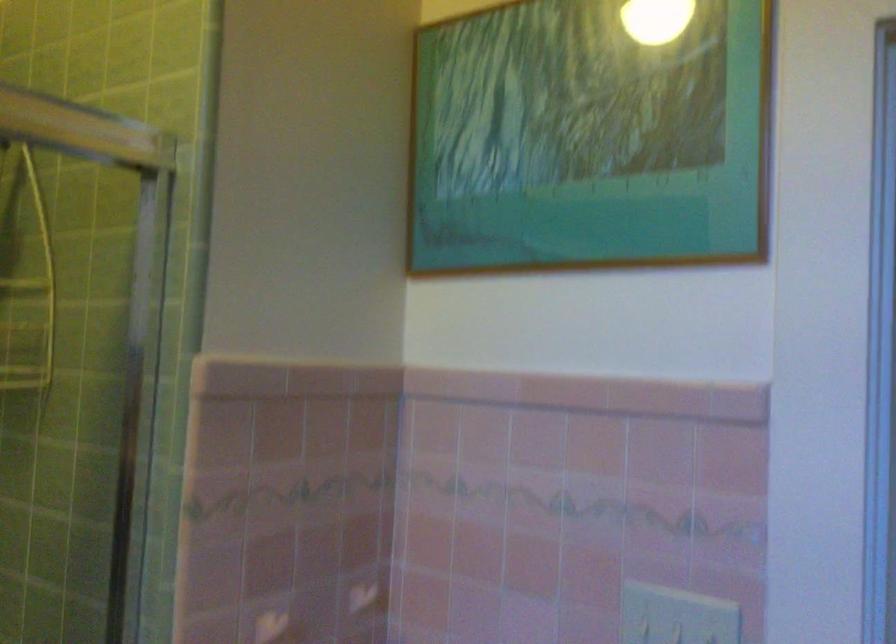
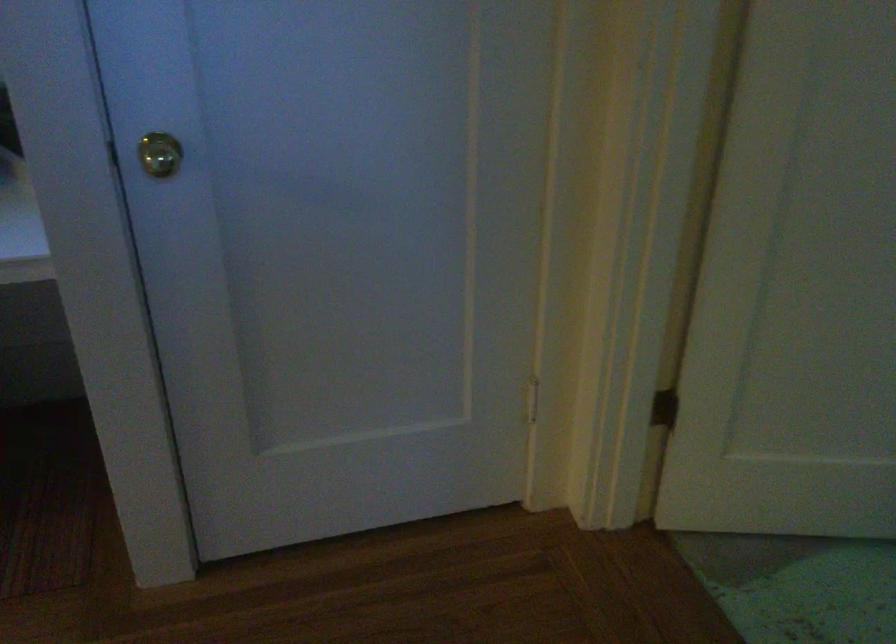
Based on the continuous images, in which direction is the camera rotating?

The camera rotated toward right-down.